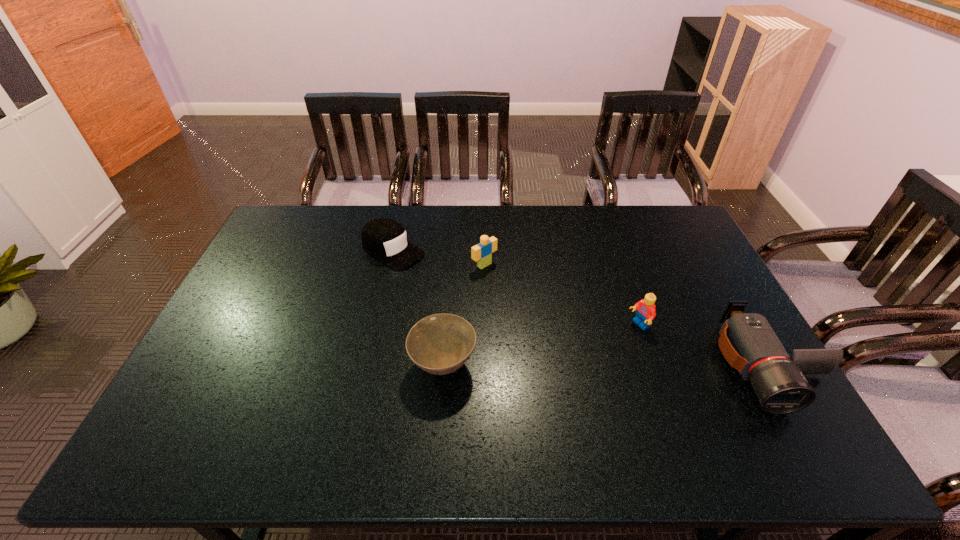
Identify the location of free space that satisfies the following two spatial constraints: 1. on the front side of the leftmost object; 2. on the right side of the right Lego. The width and height of the screenshot is (960, 540). (376, 326).